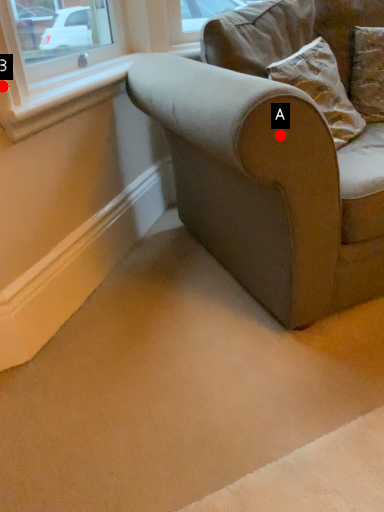
Question: Two points are circled on the image, labeled by A and B beside each circle. Among these points, which one is farthest from the camera?

Choices:
 (A) A is further
 (B) B is further

Answer: (B)